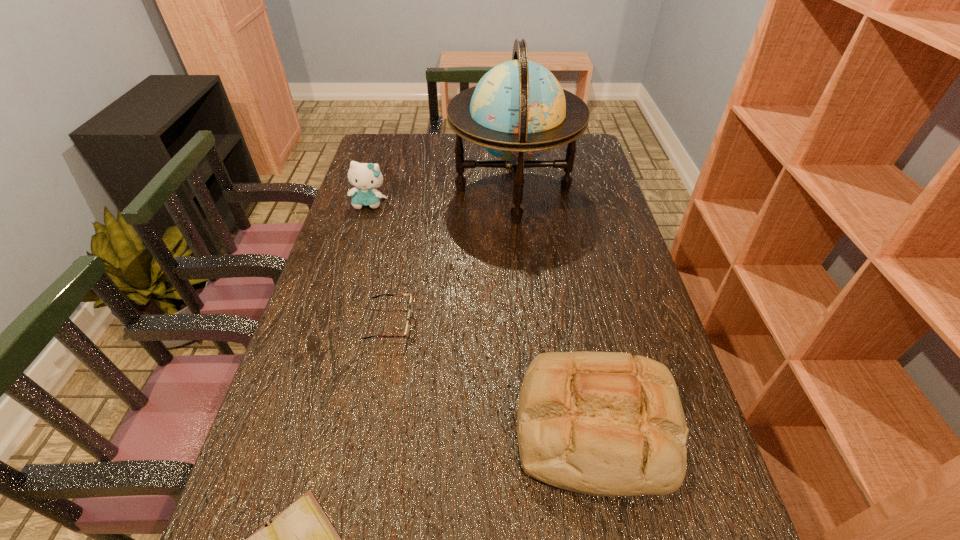
Image resolution: width=960 pixels, height=540 pixels. Find the location of `free point at the far left corner`. free point at the far left corner is located at coordinates (405, 150).

Image resolution: width=960 pixels, height=540 pixels. In the image, there is a desktop. Identify the location of free region at the far right corner. (585, 152).

In order to click on free space between the bread and the globe in this screenshot , I will do `click(555, 308)`.

Identify the location of vacant area that lies between the kitten and the fourth tallest object. (380, 264).

In order to click on vacant area that lies between the spectacles and the kitten in this screenshot , I will do coord(380,264).

In order to click on unoccupied position between the third nearest object and the kitten in this screenshot , I will do `click(380, 264)`.

This screenshot has height=540, width=960. I want to click on unoccupied position between the kitten and the globe, so [x=442, y=197].

Choose which object is the fourth nearest neighbor to the globe. Please provide its 2D coordinates. Your answer should be formatted as a tuple, i.e. [(x, y)], where the tuple contains the x and y coordinates of a point satisfying the conditions above.

[(300, 539)]

What are the coordinates of `object that stands as the fourth closest to the tallest object` in the screenshot? It's located at (300, 539).

I want to click on free region that satisfies the following two spatial constraints: 1. on the face of the bread; 2. on the left side of the kitten, so point(302,427).